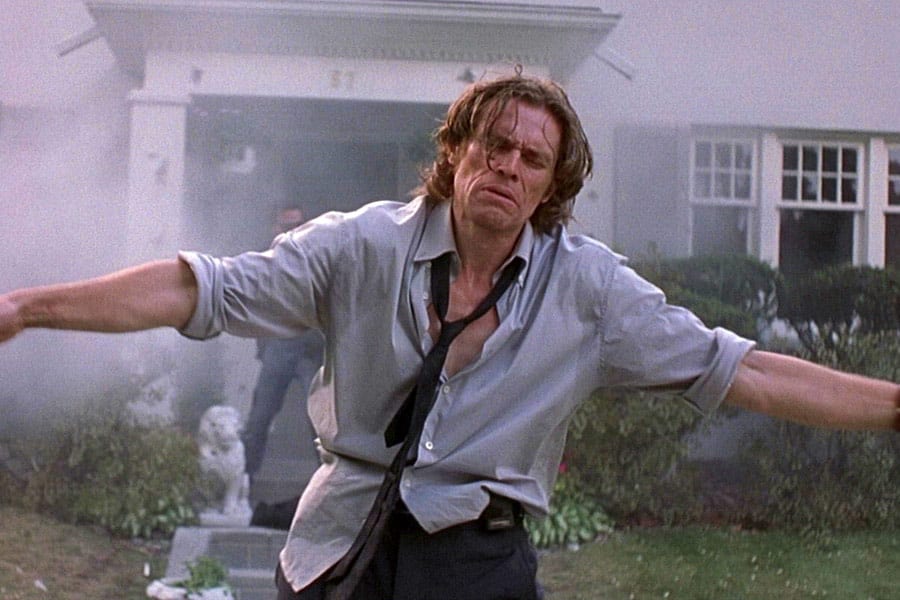
Find the location of `front door`. front door is located at coordinates (329, 180).